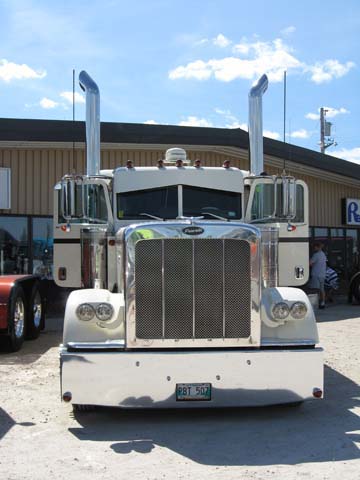
At what (x,y) coordinates should I click in order to perform the action: click on windows. Please return your answer as a coordinate pair (x, y). The height and width of the screenshot is (480, 360). Looking at the image, I should click on (78, 203), (272, 202), (143, 201), (222, 200).